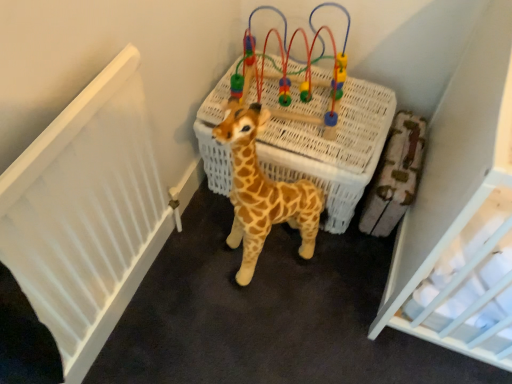
At what (x,y) coordinates should I click in order to perform the action: click on wooden bead maze at center. Please return your answer as a coordinate pair (x, y). Looking at the image, I should click on (294, 72).

The image size is (512, 384). Find the location of `white wicker basket at center`. white wicker basket at center is located at coordinates (333, 149).

Identify the location of spotted plush giraffe at center. (262, 192).

Measure the distance between point (240,166) and camera.

Point (240,166) is 3.36 feet away from camera.

Find the location of a particular element. wooden bead maze at center is located at coordinates (294, 72).

Does spotted plush giraffe at center have a lesser width compared to white wicker basket at center?

Correct, the width of spotted plush giraffe at center is less than that of white wicker basket at center.

Is spotted plush giraffe at center aimed at white wicker basket at center?

No, spotted plush giraffe at center is not turned towards white wicker basket at center.

Which object is positioned more to the left, spotted plush giraffe at center or white wicker basket at center?

Positioned to the left is spotted plush giraffe at center.

Is point (254, 208) less distant than point (285, 176)?

That is True.

From a real-world perspective, is white wicker basket at center physically above wooden bead maze at center?

No, from a real-world perspective, white wicker basket at center is not on top of wooden bead maze at center.

Is point (338, 201) positioned after point (245, 63)?

That is True.

From the image's perspective, is white wicker basket at center located above or below wooden bead maze at center?

Clearly, from the image's perspective, white wicker basket at center is below wooden bead maze at center.

Is wooden bead maze at center inside white wicker basket at center?

No, wooden bead maze at center is located outside of white wicker basket at center.

Can you confirm if spotted plush giraffe at center is shorter than wooden bead maze at center?

Incorrect, the height of spotted plush giraffe at center does not fall short of that of wooden bead maze at center.

Can you confirm if spotted plush giraffe at center is bigger than wooden bead maze at center?

Yes, spotted plush giraffe at center is bigger than wooden bead maze at center.

From the image's perspective, which object appears higher, spotted plush giraffe at center or wooden bead maze at center?

wooden bead maze at center appears higher in the image.

Does wooden bead maze at center have a greater height compared to white wicker basket at center?

In fact, wooden bead maze at center may be shorter than white wicker basket at center.

Based on the photo, between wooden bead maze at center and white wicker basket at center, which one is positioned behind?

Positioned behind is white wicker basket at center.

Is point (267, 40) farther from viewer compared to point (315, 129)?

Yes, point (267, 40) is behind point (315, 129).

Could you tell me if wooden bead maze at center is turned towards white wicker basket at center?

No, wooden bead maze at center does not turn towards white wicker basket at center.

Which object is positioned more to the left, wooden bead maze at center or spotted plush giraffe at center?

From the viewer's perspective, spotted plush giraffe at center appears more on the left side.

Is wooden bead maze at center far from spotted plush giraffe at center?

They are positioned close to each other.

Based on the photo, which object is wider, wooden bead maze at center or spotted plush giraffe at center?

wooden bead maze at center.

Does wooden bead maze at center have a greater height compared to spotted plush giraffe at center?

In fact, wooden bead maze at center may be shorter than spotted plush giraffe at center.

Is white wicker basket at center not near spotted plush giraffe at center?

No.

Which object is thinner, white wicker basket at center or spotted plush giraffe at center?

With smaller width is spotted plush giraffe at center.

From a real-world perspective, is white wicker basket at center positioned above or below spotted plush giraffe at center?

white wicker basket at center is situated lower than spotted plush giraffe at center in the real world.

Between white wicker basket at center and spotted plush giraffe at center, which one has smaller size?

Smaller between the two is spotted plush giraffe at center.

Image resolution: width=512 pixels, height=384 pixels. Identify the location of giraffe below the white wicker basket at center (from the image's perspective). (262, 192).

At what (x,y) coordinates should I click in order to perform the action: click on toy on the left of white wicker basket at center. Please return your answer as a coordinate pair (x, y). Image resolution: width=512 pixels, height=384 pixels. Looking at the image, I should click on (294, 72).

Looking at the image, which one is located further to white wicker basket at center, spotted plush giraffe at center or wooden bead maze at center?

The object further to white wicker basket at center is spotted plush giraffe at center.

When comparing their distances from wooden bead maze at center, does white wicker basket at center or spotted plush giraffe at center seem further?

Based on the image, spotted plush giraffe at center appears to be further to wooden bead maze at center.

Considering their positions, is white wicker basket at center positioned further to spotted plush giraffe at center than wooden bead maze at center?

The object further to spotted plush giraffe at center is wooden bead maze at center.

Considering their positions, is spotted plush giraffe at center positioned further to wooden bead maze at center than white wicker basket at center?

spotted plush giraffe at center is further to wooden bead maze at center.

Looking at the image, which one is located closer to white wicker basket at center, wooden bead maze at center or spotted plush giraffe at center?

Based on the image, wooden bead maze at center appears to be nearer to white wicker basket at center.

Looking at the image, which one is located closer to spotted plush giraffe at center, wooden bead maze at center or white wicker basket at center?

white wicker basket at center.

Where is `infant bed between wooden bead maze at center and spotted plush giraffe at center in the up-down direction`? This screenshot has width=512, height=384. infant bed between wooden bead maze at center and spotted plush giraffe at center in the up-down direction is located at coordinates point(333,149).